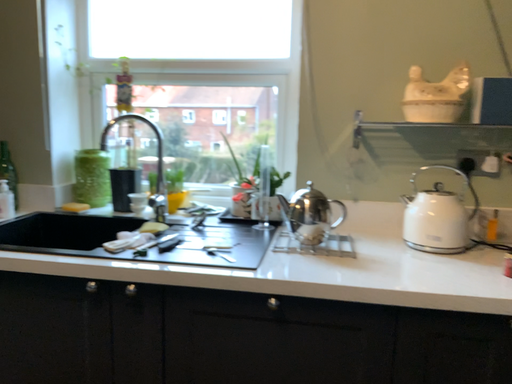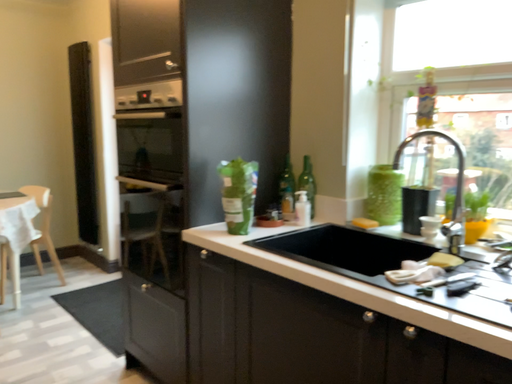
Question: Which way did the camera rotate in the video?

Choices:
 (A) rotated right
 (B) rotated left

Answer: (B)